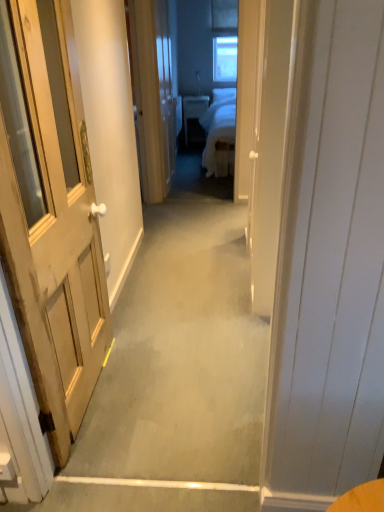
Where is `wooden door at left`? Image resolution: width=384 pixels, height=512 pixels. wooden door at left is located at coordinates (50, 215).

Image resolution: width=384 pixels, height=512 pixels. I want to click on carpeted hallway at center, so click(x=177, y=369).

The width and height of the screenshot is (384, 512). Find the location of `wooden door at left`. wooden door at left is located at coordinates (50, 215).

Is clear glass window at upper center positioned far away from wooden door at left?

Absolutely, clear glass window at upper center is distant from wooden door at left.

Does clear glass window at upper center have a lesser width compared to wooden door at left?

Yes, clear glass window at upper center is thinner than wooden door at left.

Is clear glass window at upper center not within wooden door at left?

That's correct, clear glass window at upper center is outside of wooden door at left.

Between clear glass window at upper center and wooden door at left, which one appears on the left side from the viewer's perspective?

From the viewer's perspective, wooden door at left appears more on the left side.

Is carpeted hallway at center facing towards wooden door at left?

No.

From their relative heights in the image, would you say carpeted hallway at center is taller or shorter than wooden door at left?

Considering their sizes, carpeted hallway at center has less height than wooden door at left.

Between carpeted hallway at center and wooden door at left, which one has larger size?

Bigger between the two is carpeted hallway at center.

I want to click on door located above the carpeted hallway at center (from a real-world perspective), so click(50, 215).

Is wooden door at left located outside carpeted hallway at center?

wooden door at left lies outside carpeted hallway at center's area.

Considering the relative positions of wooden door at left and carpeted hallway at center in the image provided, is wooden door at left to the left or to the right of carpeted hallway at center?

Based on their positions, wooden door at left is located to the left of carpeted hallway at center.

Does wooden door at left lie in front of carpeted hallway at center?

Yes, wooden door at left is closer to the camera.

What's the angular difference between wooden door at left and carpeted hallway at center's facing directions?

They differ by 88.6 degrees in their facing directions.

In the image, is wooden door at left positioned in front of or behind clear glass window at upper center?

In the image, wooden door at left appears in front of clear glass window at upper center.

From the picture: Is wooden door at left completely or partially outside of clear glass window at upper center?

Yes, wooden door at left is not within clear glass window at upper center.

Can you tell me how much wooden door at left and clear glass window at upper center differ in facing direction?

There is a 89.6-degree angle between the facing directions of wooden door at left and clear glass window at upper center.

Considering the relative sizes of wooden door at left and clear glass window at upper center in the image provided, is wooden door at left wider than clear glass window at upper center?

Yes.

How far apart are clear glass window at upper center and carpeted hallway at center?

The distance of clear glass window at upper center from carpeted hallway at center is 11.65 feet.

What's the angular difference between clear glass window at upper center and carpeted hallway at center's facing directions?

The angular difference between clear glass window at upper center and carpeted hallway at center is 1.04 degrees.

Is clear glass window at upper center shorter than carpeted hallway at center?

In fact, clear glass window at upper center may be taller than carpeted hallway at center.

In terms of width, does clear glass window at upper center look wider or thinner when compared to carpeted hallway at center?

Considering their sizes, clear glass window at upper center looks slimmer than carpeted hallway at center.

Considering the relative sizes of carpeted hallway at center and clear glass window at upper center in the image provided, is carpeted hallway at center taller than clear glass window at upper center?

Incorrect, the height of carpeted hallway at center is not larger of that of clear glass window at upper center.

I want to click on path below the clear glass window at upper center (from the image's perspective), so click(x=177, y=369).

Consider the image. From the image's perspective, which one is positioned lower, carpeted hallway at center or clear glass window at upper center?

From the image's view, carpeted hallway at center is below.

Is carpeted hallway at center behind clear glass window at upper center?

No, carpeted hallway at center is closer to the camera.

Where is `window above the wooden door at left (from a real-world perspective)`? This screenshot has height=512, width=384. window above the wooden door at left (from a real-world perspective) is located at coordinates (225, 59).

Locate an element on the screen. The height and width of the screenshot is (512, 384). door on the left side of carpeted hallway at center is located at coordinates (50, 215).

When comparing their distances from carpeted hallway at center, does wooden door at left or clear glass window at upper center seem closer?

wooden door at left is positioned closer to the anchor carpeted hallway at center.

When comparing their distances from carpeted hallway at center, does clear glass window at upper center or wooden door at left seem closer?

wooden door at left is positioned closer to the anchor carpeted hallway at center.

From the image, which object appears to be nearer to wooden door at left, carpeted hallway at center or clear glass window at upper center?

Based on the image, carpeted hallway at center appears to be nearer to wooden door at left.

Estimate the real-world distances between objects in this image. Which object is closer to wooden door at left, clear glass window at upper center or carpeted hallway at center?

The object closer to wooden door at left is carpeted hallway at center.

Which object lies nearer to the anchor point clear glass window at upper center, carpeted hallway at center or wooden door at left?

carpeted hallway at center is positioned closer to the anchor clear glass window at upper center.

From the image, which object appears to be farther from clear glass window at upper center, wooden door at left or carpeted hallway at center?

wooden door at left lies further to clear glass window at upper center than the other object.

Find the location of a particular element. The image size is (384, 512). path between wooden door at left and clear glass window at upper center in the front-back direction is located at coordinates (177, 369).